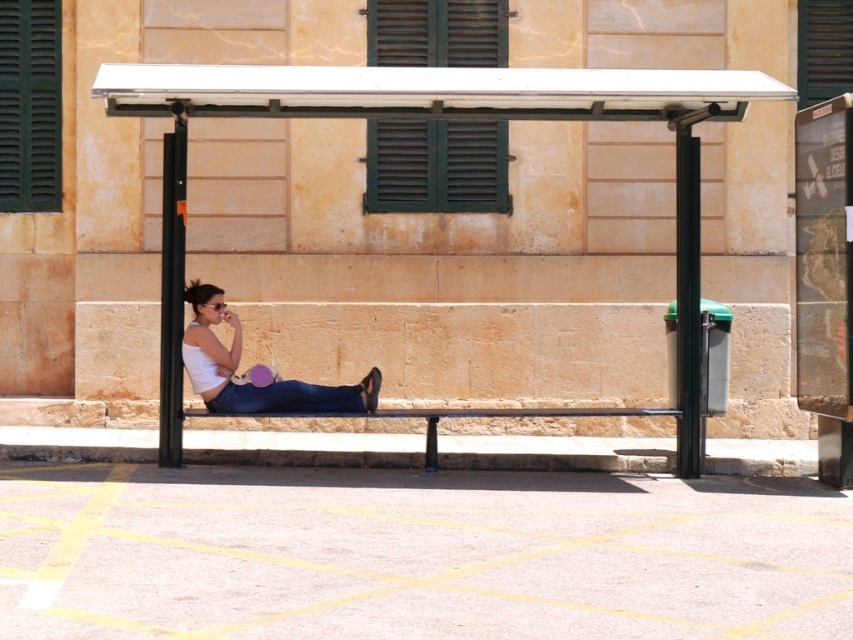
Which is above, green matte shutters at upper center or metallic black bench at center?

Positioned higher is green matte shutters at upper center.

Does green matte shutters at upper center have a greater height compared to metallic black bench at center?

Yes.

At what (x,y) coordinates should I click in order to perform the action: click on green matte shutters at upper center. Please return your answer as a coordinate pair (x, y). Looking at the image, I should click on (436, 166).

At what (x,y) coordinates should I click in order to perform the action: click on green matte shutters at upper center. Please return your answer as a coordinate pair (x, y). The width and height of the screenshot is (853, 640). Looking at the image, I should click on (436, 166).

Does point (711, 84) lie in front of point (497, 17)?

That is True.

Between point (94, 81) and point (386, 17), which one is positioned in front?

Point (386, 17) is more forward.

You are a GUI agent. You are given a task and a screenshot of the screen. Output one action in this format:
    pyautogui.click(x=<x>, y=<y>)
    Task: Click on the white plastic bench at center
    This screenshot has height=640, width=853.
    Given the screenshot: What is the action you would take?
    pyautogui.click(x=434, y=116)

Is white plastic bench at center wider than green matte shutter at upper left?

Indeed, white plastic bench at center has a greater width compared to green matte shutter at upper left.

Is point (618, 410) positioned in front of point (61, 196)?

Yes, it is.

Where is `white plastic bench at center`? The height and width of the screenshot is (640, 853). white plastic bench at center is located at coordinates (434, 116).